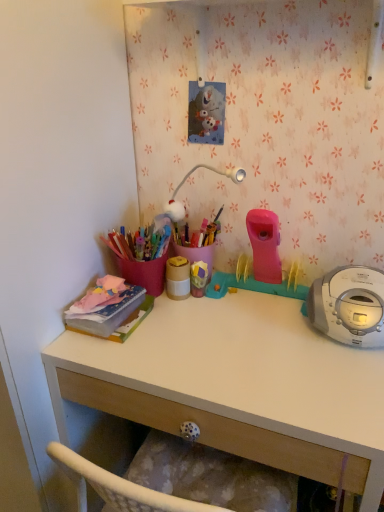
Question: Does matte pink notebook at left, marked as the 1th office supplies in a left-to-right arrangement, appear on the right side of matte gold container at center, which is the 1th office supplies from right to left?

Choices:
 (A) no
 (B) yes

Answer: (A)

Question: Is matte gold container at center, which is the 1th office supplies from right to left, at the back of matte pink notebook at left, marked as the 1th office supplies in a left-to-right arrangement?

Choices:
 (A) yes
 (B) no

Answer: (B)

Question: Is there a large distance between matte pink notebook at left, marked as the 1th office supplies in a left-to-right arrangement, and matte gold container at center, the 2th office supplies when ordered from left to right?

Choices:
 (A) no
 (B) yes

Answer: (A)

Question: From the image's perspective, is matte pink notebook at left, marked as the 1th office supplies in a left-to-right arrangement, under matte gold container at center, the 2th office supplies when ordered from left to right?

Choices:
 (A) no
 (B) yes

Answer: (B)

Question: Is matte pink notebook at left, marked as the 1th office supplies in a left-to-right arrangement, taller than matte gold container at center, the 2th office supplies when ordered from left to right?

Choices:
 (A) yes
 (B) no

Answer: (B)

Question: Is matte pink notebook at left, marked as the 1th office supplies in a left-to-right arrangement, next to matte gold container at center, the 2th office supplies when ordered from left to right, and touching it?

Choices:
 (A) yes
 (B) no

Answer: (B)

Question: Is matte pink notebook at left, marked as the 1th office supplies in a left-to-right arrangement, positioned with its back to white matte desk at center?

Choices:
 (A) no
 (B) yes

Answer: (A)

Question: Would you consider matte pink notebook at left, which is counted as the 2th office supplies, starting from the right, to be distant from white matte desk at center?

Choices:
 (A) no
 (B) yes

Answer: (A)

Question: Is matte pink notebook at left, which is counted as the 2th office supplies, starting from the right, closer to the viewer compared to white matte desk at center?

Choices:
 (A) yes
 (B) no

Answer: (B)

Question: From the image's perspective, is matte pink notebook at left, which is counted as the 2th office supplies, starting from the right, located beneath white matte desk at center?

Choices:
 (A) no
 (B) yes

Answer: (A)

Question: From the image's perspective, is matte pink notebook at left, which is counted as the 2th office supplies, starting from the right, on top of white matte desk at center?

Choices:
 (A) no
 (B) yes

Answer: (B)

Question: Can you confirm if matte pink notebook at left, marked as the 1th office supplies in a left-to-right arrangement, is thinner than white matte desk at center?

Choices:
 (A) no
 (B) yes

Answer: (B)

Question: From a real-world perspective, is white matte desk at center on top of matte pink notebook at left, which is counted as the 2th office supplies, starting from the right?

Choices:
 (A) no
 (B) yes

Answer: (A)